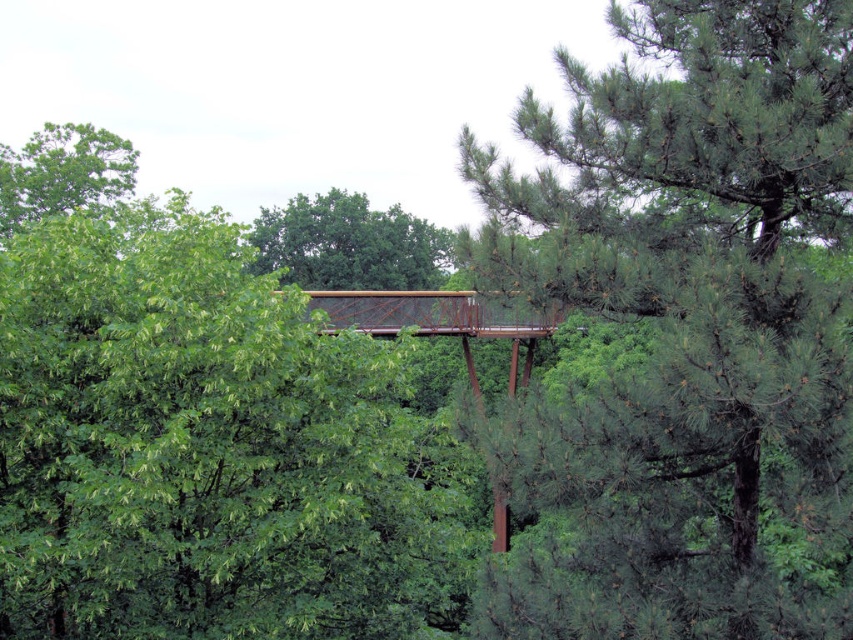
Based on the scene provided, what are the coordinates of the green pine tree at center?

The green pine tree at center is located at coordinates point (688, 330).

In the scene shown: Based on the coordinates provided, where exactly is the green pine tree at center located in the image?

The green pine tree at center is located at the coordinates point (688, 330).